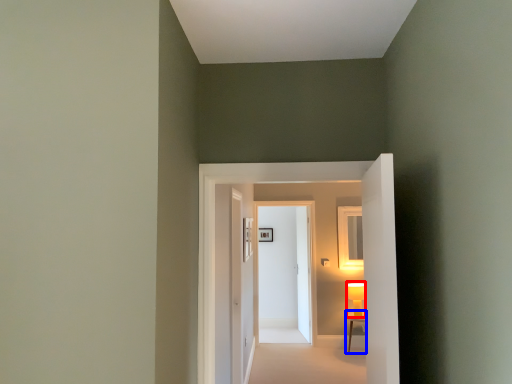
Question: Among these objects, which one is farthest to the camera, table lamp (highlighted by a red box) or table (highlighted by a blue box)?

Choices:
 (A) table lamp
 (B) table

Answer: (A)